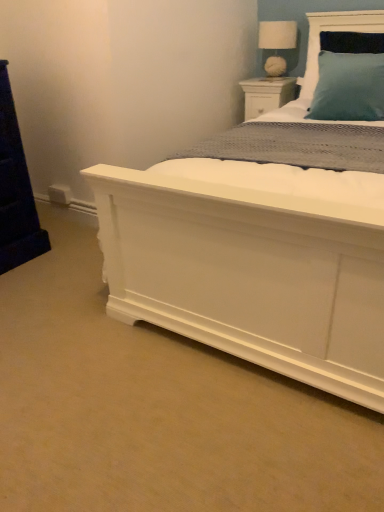
I want to click on white fabric lampshade at upper center, so click(x=277, y=44).

What do you see at coordinates (277, 44) in the screenshot? I see `white fabric lampshade at upper center` at bounding box center [277, 44].

Measure the distance between point (x=263, y=27) and camera.

The distance of point (x=263, y=27) from camera is 2.74 meters.

Find the location of `white wood nightstand at upper right`. white wood nightstand at upper right is located at coordinates (266, 94).

This screenshot has height=512, width=384. What do you see at coordinates (266, 94) in the screenshot?
I see `white wood nightstand at upper right` at bounding box center [266, 94].

Image resolution: width=384 pixels, height=512 pixels. I want to click on white fabric lampshade at upper center, so click(x=277, y=44).

Consider the image. Which is more to the left, white wood nightstand at upper right or white fabric lampshade at upper center?

white wood nightstand at upper right is more to the left.

In the image, is white wood nightstand at upper right positioned in front of or behind white fabric lampshade at upper center?

In the image, white wood nightstand at upper right appears behind white fabric lampshade at upper center.

Considering the points (246, 83) and (273, 29), which point is in front, point (246, 83) or point (273, 29)?

Positioned in front is point (273, 29).

From the image's perspective, which one is positioned lower, white wood nightstand at upper right or white fabric lampshade at upper center?

white wood nightstand at upper right appears lower in the image.

From a real-world perspective, which is physically below, white wood nightstand at upper right or white fabric lampshade at upper center?

In real-world perspective, white wood nightstand at upper right is lower.

Between white wood nightstand at upper right and white fabric lampshade at upper center, which one has smaller width?

white fabric lampshade at upper center.

Considering the sizes of objects white wood nightstand at upper right and white fabric lampshade at upper center in the image provided, who is shorter, white wood nightstand at upper right or white fabric lampshade at upper center?

With less height is white wood nightstand at upper right.

Who is bigger, white wood nightstand at upper right or white fabric lampshade at upper center?

Bigger between the two is white wood nightstand at upper right.

Does white wood nightstand at upper right contain white fabric lampshade at upper center?

No.

Would you say white wood nightstand at upper right is a long distance from white fabric lampshade at upper center?

Actually, white wood nightstand at upper right and white fabric lampshade at upper center are a little close together.

Is white wood nightstand at upper right aimed at white fabric lampshade at upper center?

No, white wood nightstand at upper right is not oriented towards white fabric lampshade at upper center.

Where is `table lamp located above the white wood nightstand at upper right (from a real-world perspective)`? The image size is (384, 512). table lamp located above the white wood nightstand at upper right (from a real-world perspective) is located at coordinates (277, 44).

Would you say white fabric lampshade at upper center is to the left or to the right of white wood nightstand at upper right in the picture?

From the image, it's evident that white fabric lampshade at upper center is to the right of white wood nightstand at upper right.

Does white fabric lampshade at upper center lie in front of white wood nightstand at upper right?

Yes, white fabric lampshade at upper center is closer to the viewer.

Does point (278, 46) lie in front of point (258, 106)?

Yes, point (278, 46) is closer to viewer.

From the image's perspective, who appears lower, white fabric lampshade at upper center or white wood nightstand at upper right?

white wood nightstand at upper right, from the image's perspective.

From a real-world perspective, is white fabric lampshade at upper center over white wood nightstand at upper right?

Yes.

Can you confirm if white fabric lampshade at upper center is wider than white wood nightstand at upper right?

No.

Is white fabric lampshade at upper center taller than white wood nightstand at upper right?

Yes, white fabric lampshade at upper center is taller than white wood nightstand at upper right.

Which of these two, white fabric lampshade at upper center or white wood nightstand at upper right, is smaller?

Smaller between the two is white fabric lampshade at upper center.

Does white fabric lampshade at upper center contain white wood nightstand at upper right?

No, white fabric lampshade at upper center does not contain white wood nightstand at upper right.

Is white fabric lampshade at upper center positioned far away from white wood nightstand at upper right?

Actually, white fabric lampshade at upper center and white wood nightstand at upper right are a little close together.

Is white fabric lampshade at upper center positioned with its back to white wood nightstand at upper right?

white fabric lampshade at upper center is not turned away from white wood nightstand at upper right.

What's the angular difference between white fabric lampshade at upper center and white wood nightstand at upper right's facing directions?

There is a 0.00168-degree angle between the facing directions of white fabric lampshade at upper center and white wood nightstand at upper right.

How much distance is there between white fabric lampshade at upper center and white wood nightstand at upper right?

They are 8.90 inches apart.

At what (x,y) coordinates should I click in order to perform the action: click on table lamp that appears above the white wood nightstand at upper right (from a real-world perspective). Please return your answer as a coordinate pair (x, y). Looking at the image, I should click on (277, 44).

Where is `nightstand below the white fabric lampshade at upper center (from the image's perspective)`? The height and width of the screenshot is (512, 384). nightstand below the white fabric lampshade at upper center (from the image's perspective) is located at coordinates (266, 94).

Locate an element on the screen. The width and height of the screenshot is (384, 512). table lamp that is in front of the white wood nightstand at upper right is located at coordinates (277, 44).